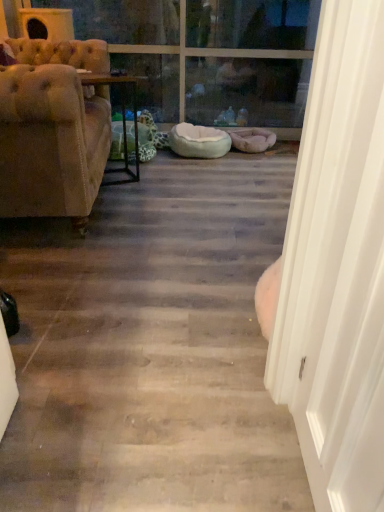
Question: Should I look upward or downward to see tufted beige fabric couch at left?

Choices:
 (A) up
 (B) down

Answer: (A)

Question: From a real-world perspective, is clear glass window at upper center physically above transparent glass door at upper center?

Choices:
 (A) yes
 (B) no

Answer: (A)

Question: Does clear glass window at upper center appear on the right side of transparent glass door at upper center?

Choices:
 (A) yes
 (B) no

Answer: (B)

Question: Does clear glass window at upper center have a greater height compared to transparent glass door at upper center?

Choices:
 (A) yes
 (B) no

Answer: (A)

Question: Is clear glass window at upper center at the left side of transparent glass door at upper center?

Choices:
 (A) yes
 (B) no

Answer: (A)

Question: Considering the relative sizes of clear glass window at upper center and transparent glass door at upper center in the image provided, is clear glass window at upper center shorter than transparent glass door at upper center?

Choices:
 (A) no
 (B) yes

Answer: (A)

Question: Is clear glass window at upper center positioned with its back to transparent glass door at upper center?

Choices:
 (A) yes
 (B) no

Answer: (B)

Question: Considering the relative sizes of tufted beige fabric couch at left and light blue plush dog bed at center in the image provided, is tufted beige fabric couch at left bigger than light blue plush dog bed at center?

Choices:
 (A) no
 (B) yes

Answer: (B)

Question: Could you tell me if tufted beige fabric couch at left is facing light blue plush dog bed at center?

Choices:
 (A) yes
 (B) no

Answer: (A)

Question: Does tufted beige fabric couch at left have a smaller size compared to light blue plush dog bed at center?

Choices:
 (A) no
 (B) yes

Answer: (A)

Question: From a real-world perspective, is tufted beige fabric couch at left physically below light blue plush dog bed at center?

Choices:
 (A) no
 (B) yes

Answer: (A)

Question: Is tufted beige fabric couch at left thinner than light blue plush dog bed at center?

Choices:
 (A) no
 (B) yes

Answer: (A)

Question: Can you confirm if tufted beige fabric couch at left is positioned to the left of light blue plush dog bed at center?

Choices:
 (A) yes
 (B) no

Answer: (A)

Question: From the image's perspective, is white smooth door at right on top of tufted beige fabric couch at left?

Choices:
 (A) yes
 (B) no

Answer: (B)